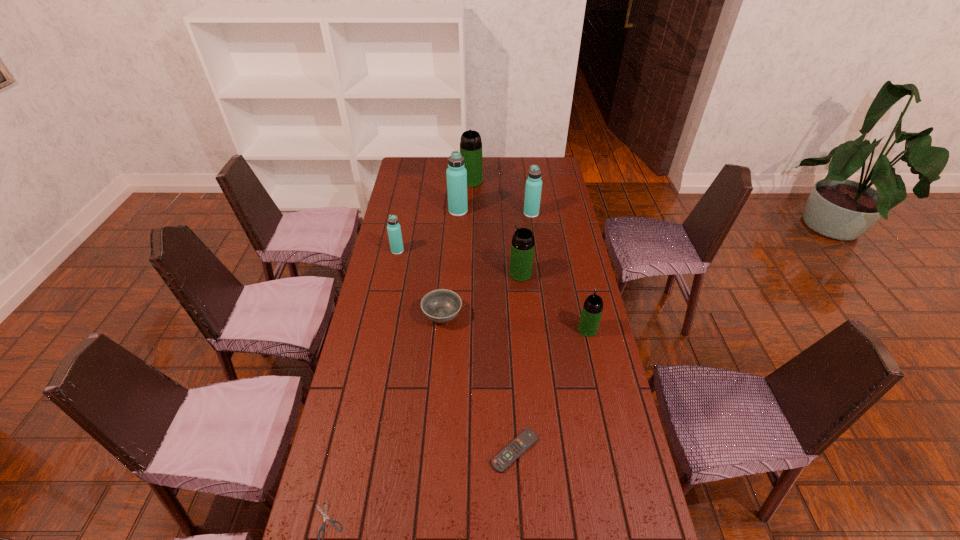
The width and height of the screenshot is (960, 540). What are the coordinates of `the farthest thermos bottle` in the screenshot? It's located at (470, 144).

Image resolution: width=960 pixels, height=540 pixels. Find the location of `the farthest green thermos bottle`. the farthest green thermos bottle is located at coordinates (470, 144).

Find the location of `the biggest aqua thermos bottle`. the biggest aqua thermos bottle is located at coordinates (456, 173).

Locate an element on the screen. Image resolution: width=960 pixels, height=540 pixels. the second biggest green thermos bottle is located at coordinates (522, 247).

Locate an element on the screen. the second farthest green thermos bottle is located at coordinates (522, 247).

In order to click on the rightmost aqua thermos bottle in this screenshot , I will do `click(533, 188)`.

The height and width of the screenshot is (540, 960). I want to click on the rightmost green thermos bottle, so click(x=592, y=309).

This screenshot has width=960, height=540. Find the location of `the smallest green thermos bottle`. the smallest green thermos bottle is located at coordinates (592, 309).

Where is `the fourth farthest object`? the fourth farthest object is located at coordinates (394, 231).

You are a GUI agent. You are given a task and a screenshot of the screen. Output one action in this format:
    pyautogui.click(x=<x>, y=<y>)
    Task: Click on the smallest aqua thermos bottle
    The image size is (960, 540).
    Given the screenshot: What is the action you would take?
    pyautogui.click(x=394, y=231)